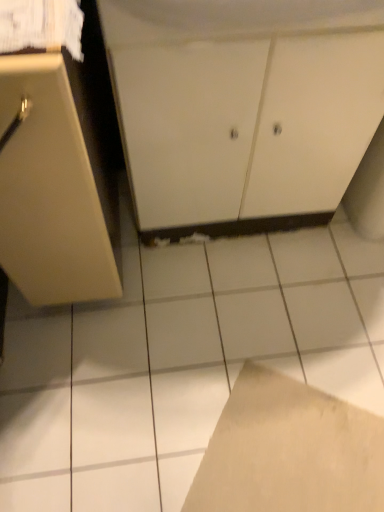
Question: Would you say matte beige cabinet at left, which is counted as the 2th cabinetry, starting from the right, is inside or outside white matte cabinet at center, which is counted as the second cabinetry, starting from the left?

Choices:
 (A) inside
 (B) outside

Answer: (B)

Question: Visually, is matte beige cabinet at left, which is counted as the 2th cabinetry, starting from the right, positioned to the left or to the right of white matte cabinet at center, which is counted as the second cabinetry, starting from the left?

Choices:
 (A) right
 (B) left

Answer: (B)

Question: Based on their relative distances, which object is farther from the white matte cabinet at center, which is counted as the second cabinetry, starting from the left?

Choices:
 (A) matte beige cabinet at left, marked as the first cabinetry in a left-to-right arrangement
 (B) white glossy tile at center
 (C) brown cardboard at lower center

Answer: (C)

Question: Considering the real-world distances, which object is farthest from the white matte cabinet at center, which is counted as the second cabinetry, starting from the left?

Choices:
 (A) white glossy tile at center
 (B) matte beige cabinet at left, marked as the first cabinetry in a left-to-right arrangement
 (C) brown cardboard at lower center

Answer: (C)